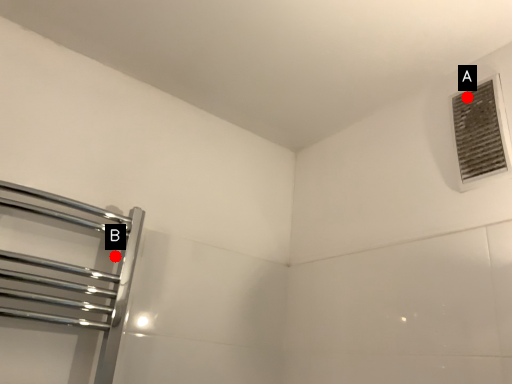
Question: Two points are circled on the image, labeled by A and B beside each circle. Which point appears closest to the camera in this image?

Choices:
 (A) A is closer
 (B) B is closer

Answer: (A)